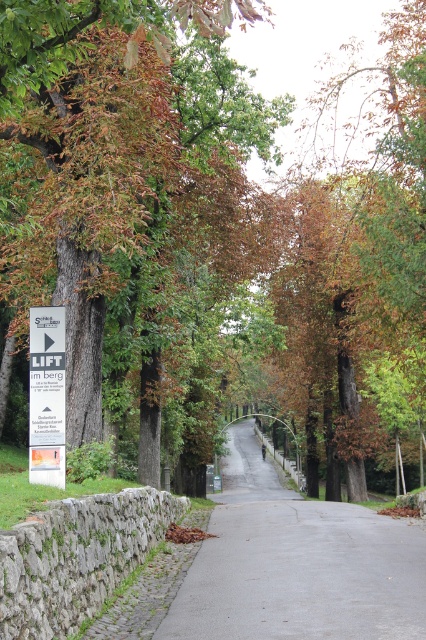
You are standing at the point labeled as point (296, 563) in the image. Based on the scene description, what type of surface are you currently standing on?

The point (296, 563) corresponds to the gray asphalt road at center, so you are standing on asphalt.